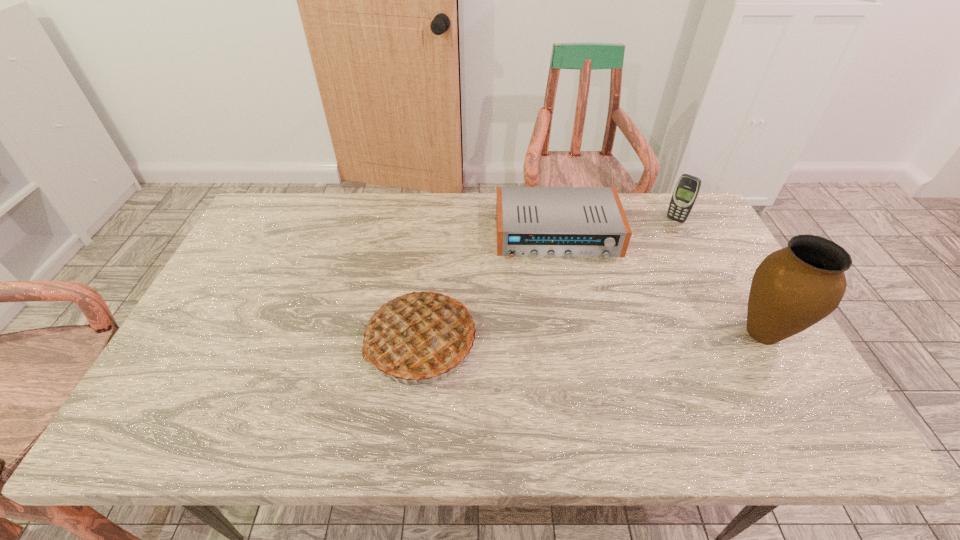
Find the location of a particular element. The height and width of the screenshot is (540, 960). free space located on the screen of the cellular telephone is located at coordinates (633, 271).

Where is `vacant space located on the front panel of the shortest object`? The image size is (960, 540). vacant space located on the front panel of the shortest object is located at coordinates (579, 361).

I want to click on vacant space located 0.390m on the front panel of the shortest object, so click(581, 372).

Identify the location of vacant region located on the front panel of the shortest object. The image size is (960, 540). (569, 306).

Where is `cellular telephone that is positioned at the far edge`? The width and height of the screenshot is (960, 540). cellular telephone that is positioned at the far edge is located at coordinates (687, 188).

Locate an element on the screen. radio receiver located at the far edge is located at coordinates (568, 222).

This screenshot has width=960, height=540. In order to click on object present at the near edge in this screenshot , I will do `click(420, 336)`.

Locate an element on the screen. The height and width of the screenshot is (540, 960). urn present at the right edge is located at coordinates (795, 287).

Locate an element on the screen. cellular telephone at the right edge is located at coordinates (687, 188).

Locate an element on the screen. The image size is (960, 540). object that is at the far right corner is located at coordinates (687, 188).